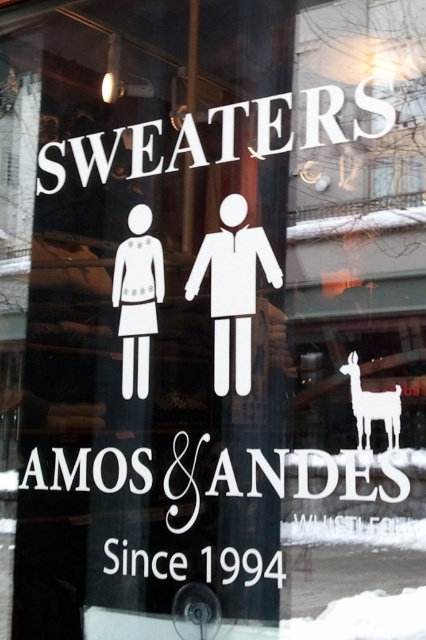
Is white paper figure at left taller than white matte llama at upper right?

Yes, white paper figure at left is taller than white matte llama at upper right.

Does point (131, 300) come closer to viewer compared to point (396, 442)?

No, (131, 300) is behind (396, 442).

You are a GUI agent. You are given a task and a screenshot of the screen. Output one action in this format:
    pyautogui.click(x=<x>, y=<y>)
    Task: Click on the white paper figure at left
    
    Given the screenshot: What is the action you would take?
    pyautogui.click(x=138, y=298)

Does white matte sign at upper center have a lesser height compared to white paper figure at left?

Yes, white matte sign at upper center is shorter than white paper figure at left.

Is white matte sign at upper center smaller than white paper figure at left?

No, white matte sign at upper center is not smaller than white paper figure at left.

In the scene shown: Who is more distant from viewer, (150, 136) or (143, 355)?

The point (150, 136) is behind.

Find the location of a particular element. The width and height of the screenshot is (426, 640). white matte sign at upper center is located at coordinates (115, 154).

Who is taller, white matte sign at upper center or white matte llama at upper right?

white matte llama at upper right

Does white matte sign at upper center have a lesser width compared to white matte llama at upper right?

Incorrect, white matte sign at upper center's width is not less than white matte llama at upper right's.

Measure the distance between white matte sign at upper center and camera.

A distance of 1.41 meters exists between white matte sign at upper center and camera.

Image resolution: width=426 pixels, height=640 pixels. What are the coordinates of `white matte sign at upper center` in the screenshot? It's located at (115, 154).